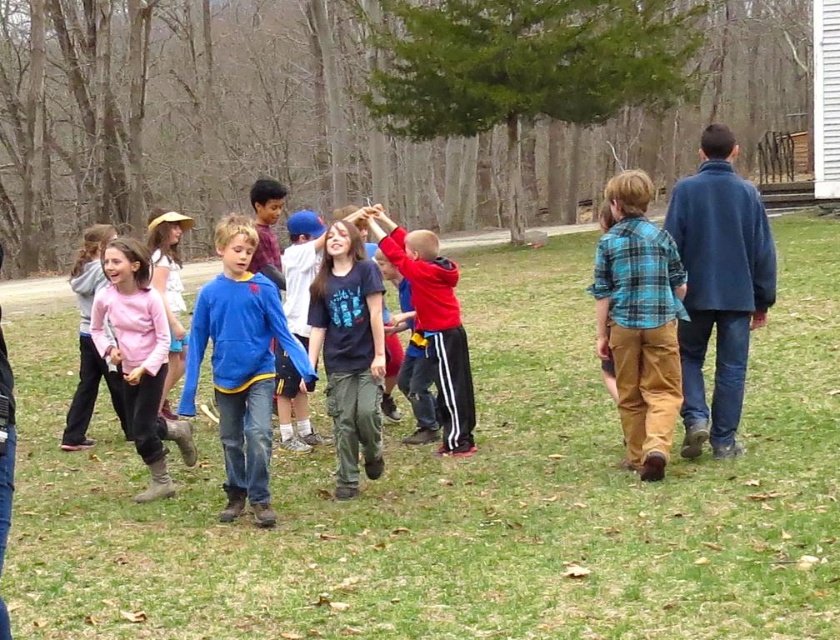
Between blue plaid shirt at center and blue fleece jacket at center, which one has more height?

With more height is blue plaid shirt at center.

Who is shorter, blue plaid shirt at center or blue fleece jacket at center?

blue fleece jacket at center

Who is more distant from viewer, (663, 456) or (237, 392)?

The point (663, 456) is behind.

This screenshot has width=840, height=640. I want to click on blue plaid shirt at center, so click(x=639, y=321).

Describe the element at coordinates (349, 352) in the screenshot. This screenshot has height=640, width=840. I see `dark blue t-shirt at center` at that location.

Image resolution: width=840 pixels, height=640 pixels. Identify the location of dark blue t-shirt at center. (349, 352).

Between point (258, 330) and point (156, 428), which one is positioned in front?

Point (258, 330)

Where is `blue fleece jacket at center`? The image size is (840, 640). blue fleece jacket at center is located at coordinates (240, 365).